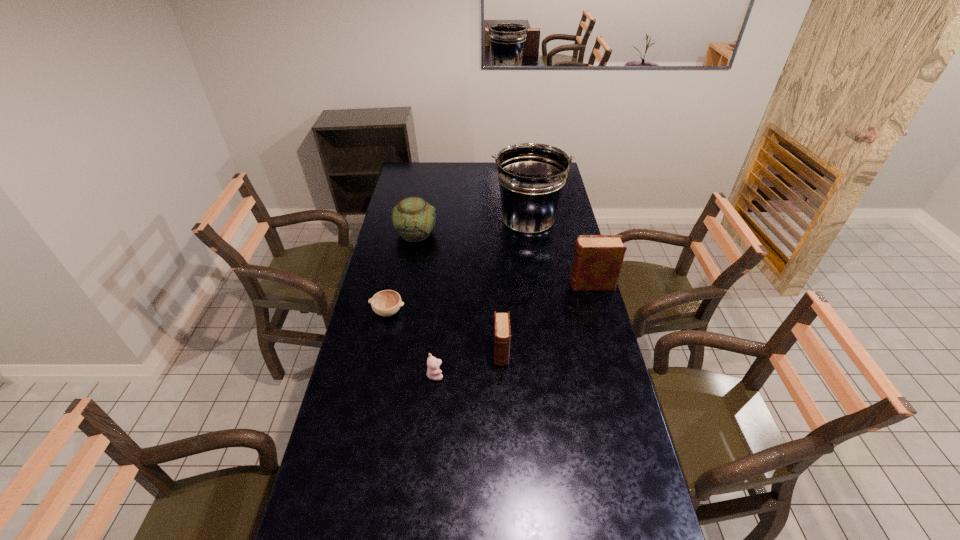
Identify the location of diary that is at the right edge. This screenshot has width=960, height=540. (597, 261).

Locate an element on the screen. The height and width of the screenshot is (540, 960). bucket at the right edge is located at coordinates (531, 176).

Locate an element on the screen. The image size is (960, 540). vacant space at the far edge of the desktop is located at coordinates (437, 173).

Find the location of a particular element. Image resolution: width=960 pixels, height=540 pixels. vacant area at the near edge of the desktop is located at coordinates (432, 517).

In the image, there is a desktop. Where is `vacant space at the left edge`? This screenshot has width=960, height=540. vacant space at the left edge is located at coordinates (357, 330).

Where is `vacant space at the right edge`? The height and width of the screenshot is (540, 960). vacant space at the right edge is located at coordinates (592, 298).

Where is `vacant space at the far left corner`? Image resolution: width=960 pixels, height=540 pixels. vacant space at the far left corner is located at coordinates (406, 167).

I want to click on free space between the third nearest object and the tallest object, so click(458, 267).

Locate an element on the screen. blank region between the third object from left to right and the tallest object is located at coordinates (482, 299).

The image size is (960, 540). Identify the location of free space between the pottery and the shortest object. (401, 273).